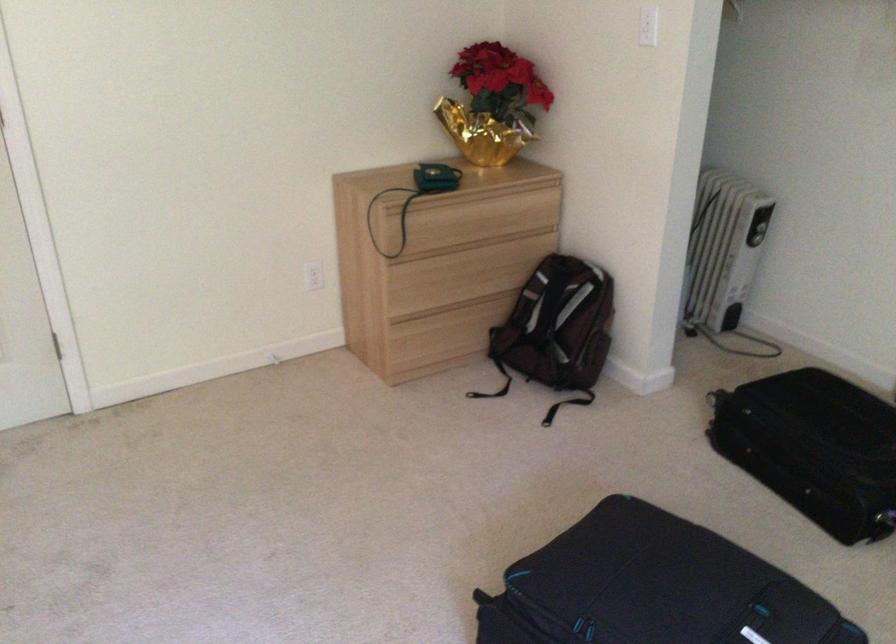
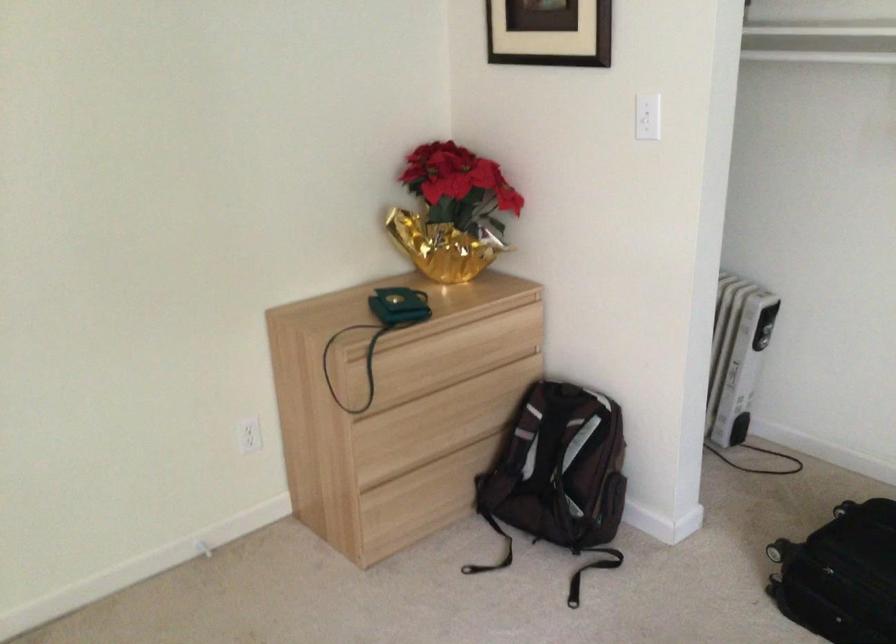
Locate, in the second image, the point that corresponds to [752,236] in the first image.

(761, 339)